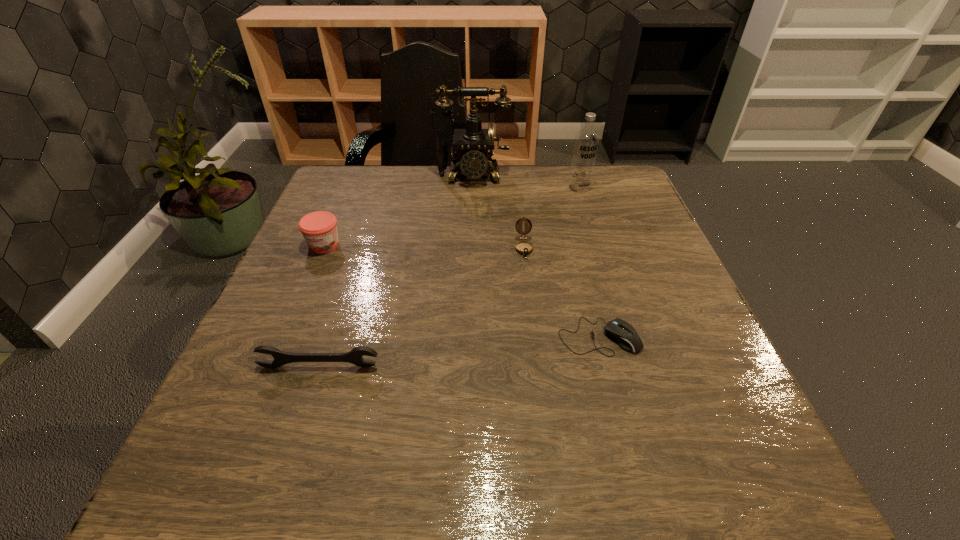
This screenshot has height=540, width=960. I want to click on vacant space located on the face of the compass, so click(x=529, y=290).

Locate an element on the screen. vacant position located 0.070m on the open ends of the nearest object is located at coordinates (306, 406).

This screenshot has width=960, height=540. I want to click on vacant space located on the left of the fifth farthest object, so click(x=520, y=336).

Find the location of a particular element. telephone present at the far edge is located at coordinates pos(471,145).

Locate an element on the screen. The image size is (960, 540). vodka at the far edge is located at coordinates (586, 141).

Find the location of a particular element. The height and width of the screenshot is (540, 960). jam that is at the left edge is located at coordinates (319, 229).

Where is `wrench located in the left edge section of the desktop`? This screenshot has width=960, height=540. wrench located in the left edge section of the desktop is located at coordinates (354, 356).

I want to click on vodka located at the right edge, so click(586, 141).

The height and width of the screenshot is (540, 960). What are the coordinates of `computer mouse situated at the right edge` in the screenshot? It's located at (622, 332).

Where is `object that is at the far right corner`? object that is at the far right corner is located at coordinates (586, 141).